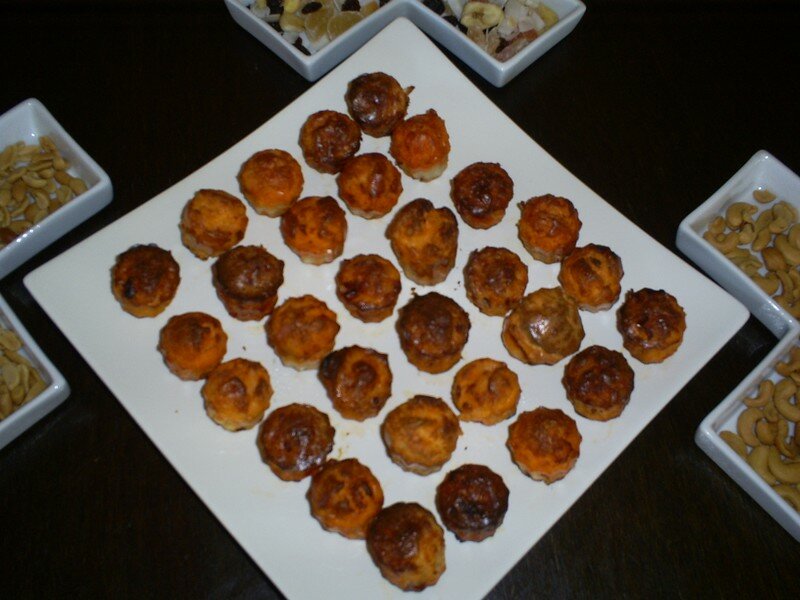
Find the location of a particular element. The width and height of the screenshot is (800, 600). empty table space is located at coordinates (161, 39), (664, 84), (682, 474), (77, 551).